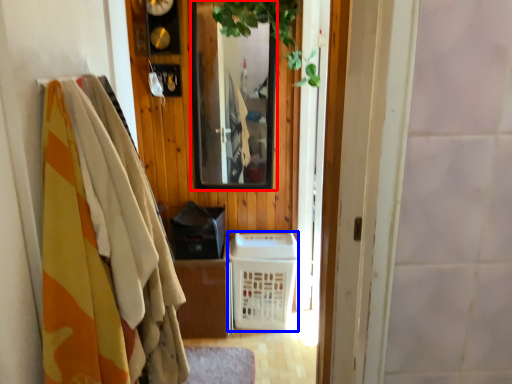
Question: Which point is closer to the camera, mirror (highlighted by a red box) or basket (highlighted by a blue box)?

Choices:
 (A) mirror
 (B) basket

Answer: (A)